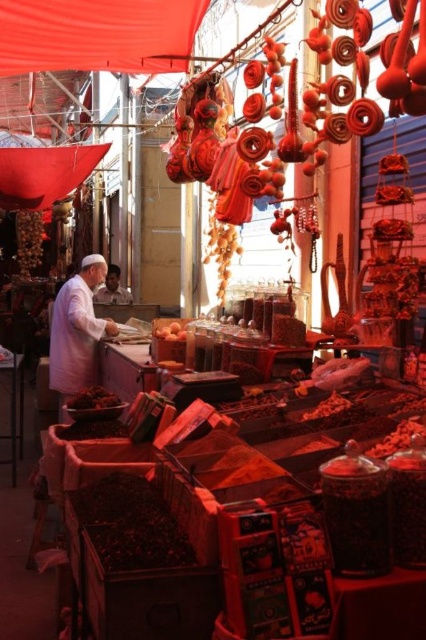
Question: Which point is farther to the camera?

Choices:
 (A) (118, 301)
 (B) (81, 420)
 (C) (81, 300)

Answer: (A)

Question: Does brown matte dried fruit at center have a larger size compared to white fabric man at left?

Choices:
 (A) yes
 (B) no

Answer: (B)

Question: Which of the following is the farthest from the observer?

Choices:
 (A) brown matte dried fruit at center
 (B) dark brown matte dried fruit at lower left
 (C) white fabric man at left
 (D) white cotton shirt at left

Answer: (C)

Question: Estimate the real-world distances between objects in this image. Which object is farther from the white fabric man at left?

Choices:
 (A) dark brown matte dried fruit at lower left
 (B) brown matte dried fruit at center

Answer: (B)

Question: Is white cotton shirt at left bigger than dark brown matte dried fruit at lower left?

Choices:
 (A) yes
 (B) no

Answer: (A)

Question: Is white cotton shirt at left smaller than brown matte dried fruit at center?

Choices:
 (A) no
 (B) yes

Answer: (A)